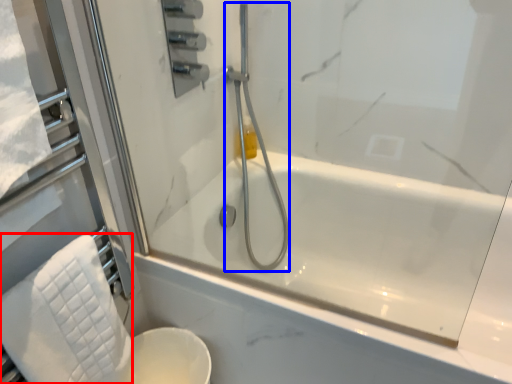
Question: Which object is further to the camera taking this photo, bath towel (highlighted by a red box) or shower (highlighted by a blue box)?

Choices:
 (A) bath towel
 (B) shower

Answer: (B)